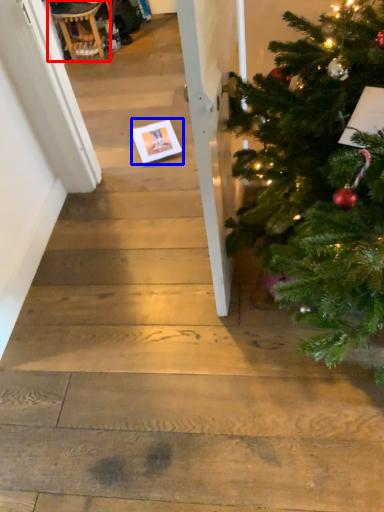
Question: Which object is further to the camera taking this photo, rocking chair (highlighted by a red box) or christmas card (highlighted by a blue box)?

Choices:
 (A) rocking chair
 (B) christmas card

Answer: (A)